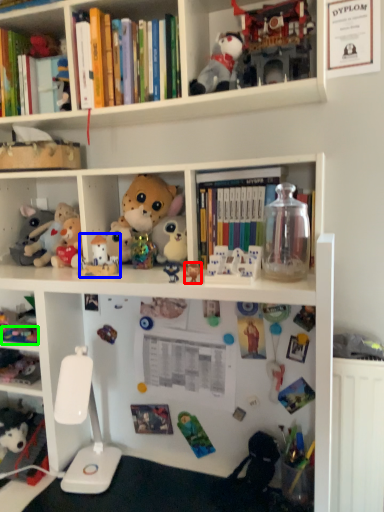
Question: Based on their relative distances, which object is nearer to toy (highlighted by a red box)? Choose from toy (highlighted by a blue box) and toy (highlighted by a green box).

Choices:
 (A) toy
 (B) toy

Answer: (A)